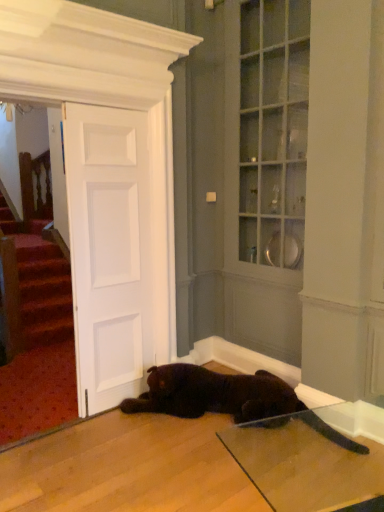
At what (x,y) coordinates should I click in order to perform the action: click on free space below shiny black cat at lower center (from a real-world perspective). Please return your answer as a coordinate pair (x, y). Looking at the image, I should click on (246, 449).